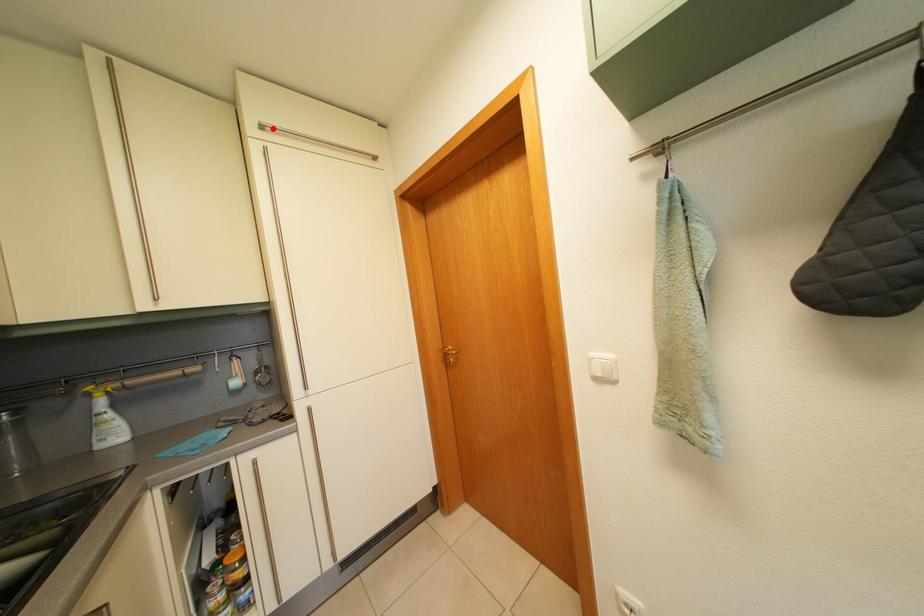
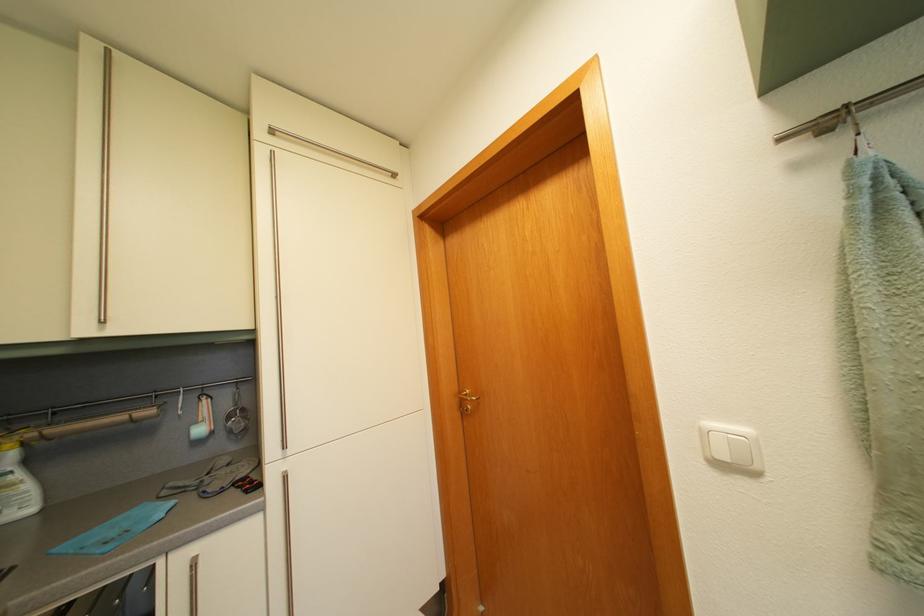
Where in the second image is the point corresponding to the highlighted location from the first image?

(284, 132)